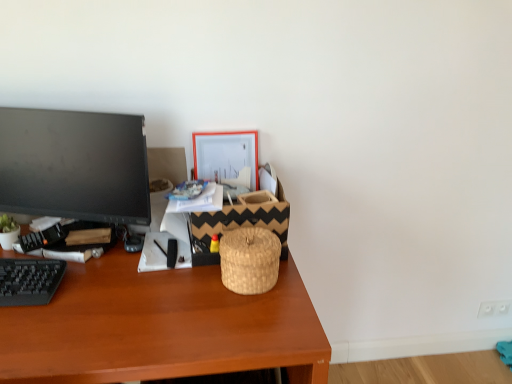
The width and height of the screenshot is (512, 384). In order to click on space that is in front of woven natural basket at center, the first basket in the front-to-back sequence in this screenshot , I will do `click(249, 325)`.